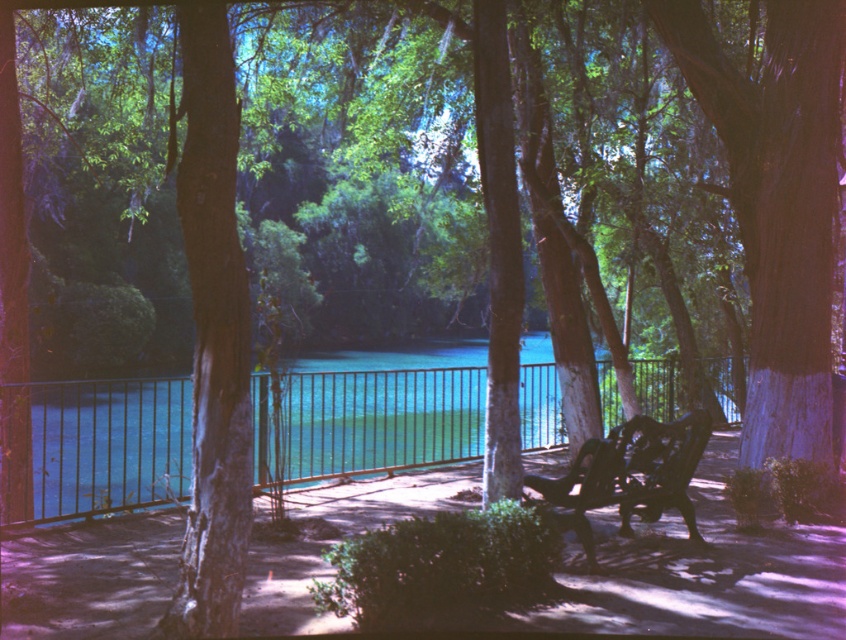
In the scene shown: You are a visitor standing on the pathway and want to sit down. The teal glass water at center and the dark brown wood bench at center are both in your view. Which object is taller?

The teal glass water at center is taller than the dark brown wood bench at center.

You are standing on the paved pathway bordered by a metal railing in the foreground of the serene outdoor scene. You notice a point marked at coordinates (97, 448). What object is located at this coordinate?

The point at coordinates (97, 448) indicates the teal glass water at center.